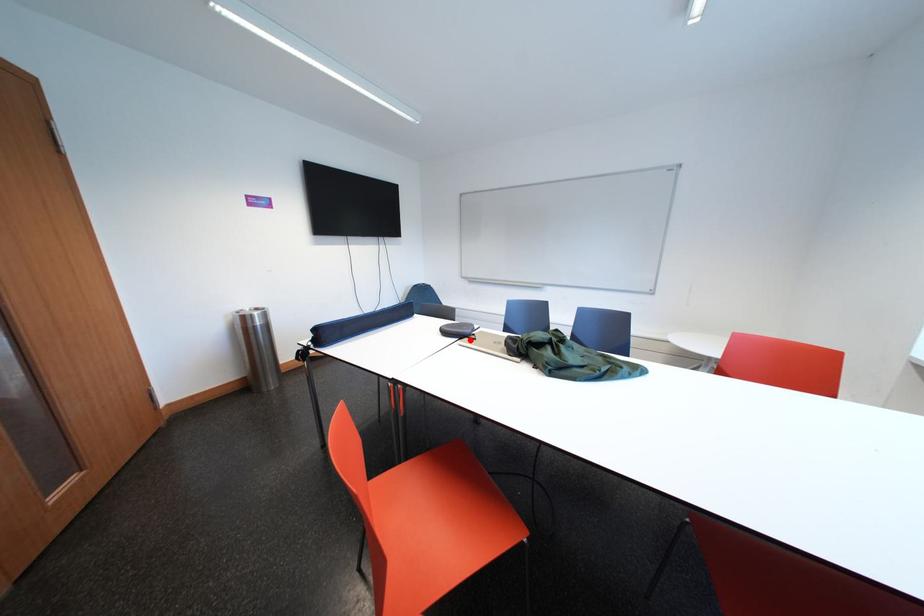
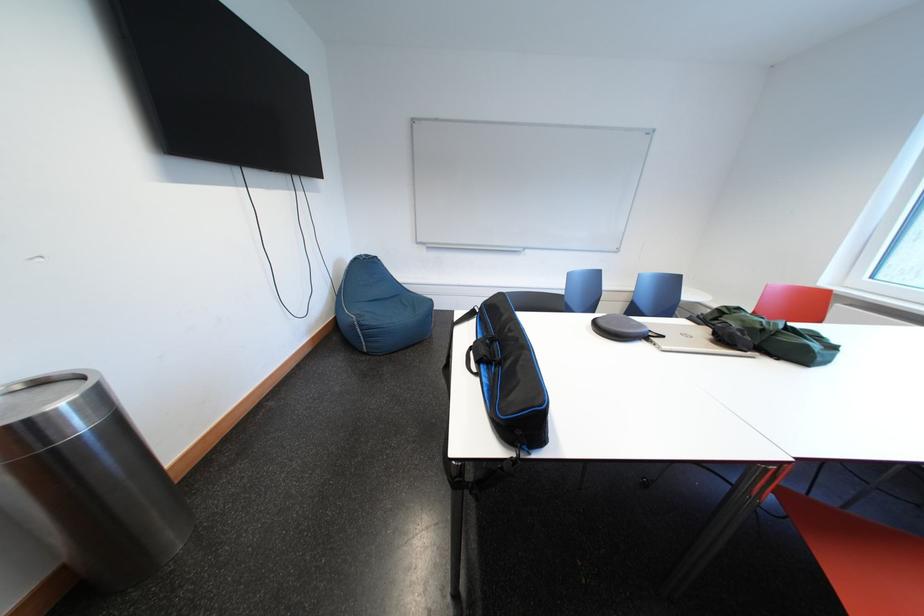
Where in the second image is the point corresponding to the highlighted location from the first image?

(657, 341)